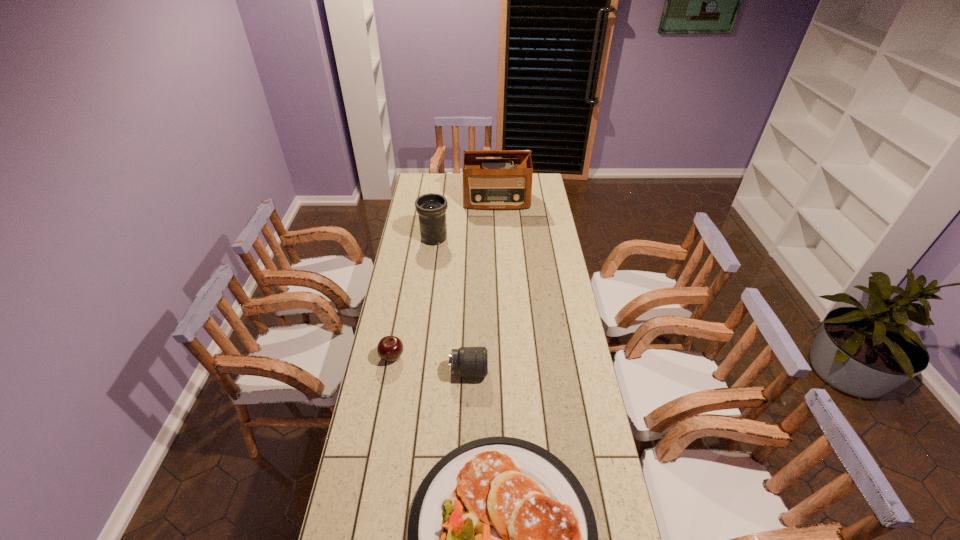
The height and width of the screenshot is (540, 960). Identify the location of free spot between the farthest object and the farther telephoto lens. (466, 220).

The image size is (960, 540). Identify the location of unoccupied position between the radio receiver and the apple. (444, 279).

Identify the location of empty space between the apple and the shorter telephoto lens. (430, 364).

Identify the location of free space between the farther telephoto lens and the apple. The width and height of the screenshot is (960, 540). (413, 298).

I want to click on free spot between the right telephoto lens and the apple, so click(430, 364).

You are a GUI agent. You are given a task and a screenshot of the screen. Output one action in this format:
    pyautogui.click(x=<x>, y=<y>)
    Task: Click on the free space between the radio receiver and the apple
    Image resolution: width=960 pixels, height=540 pixels.
    Given the screenshot: What is the action you would take?
    pyautogui.click(x=444, y=279)

Identify which object is the closest to the shorter telephoto lens. Please provide its 2D coordinates. Your answer should be formatted as a tuple, i.e. [(x, y)], where the tuple contains the x and y coordinates of a point satisfying the conditions above.

[(390, 348)]

Identify which object is the second closest to the taller telephoto lens. Please provide its 2D coordinates. Your answer should be formatted as a tuple, i.e. [(x, y)], where the tuple contains the x and y coordinates of a point satisfying the conditions above.

[(390, 348)]

Identify the location of free space that satisfies the following two spatial constraints: 1. on the front panel of the farthest object; 2. on the surface of the nearer telephoto lens. (506, 372).